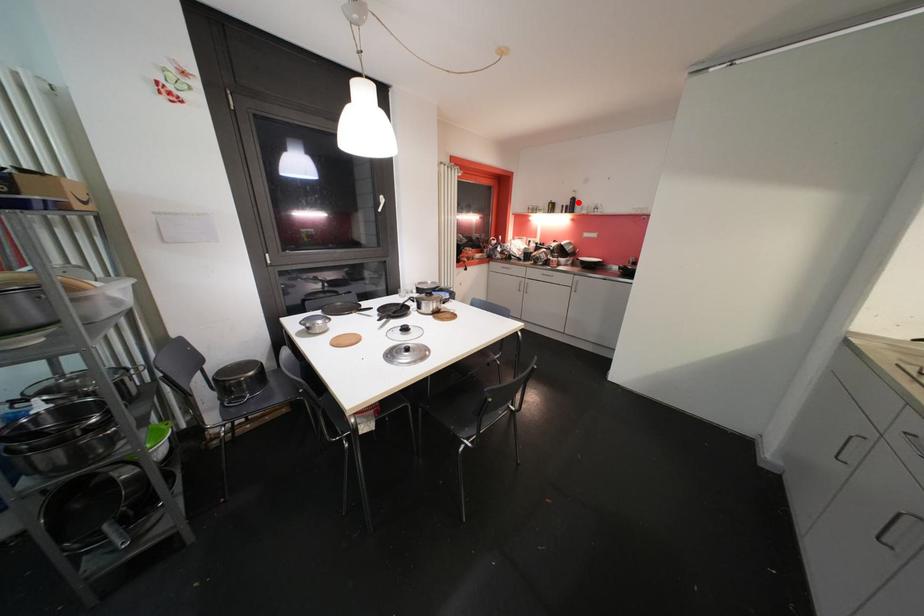
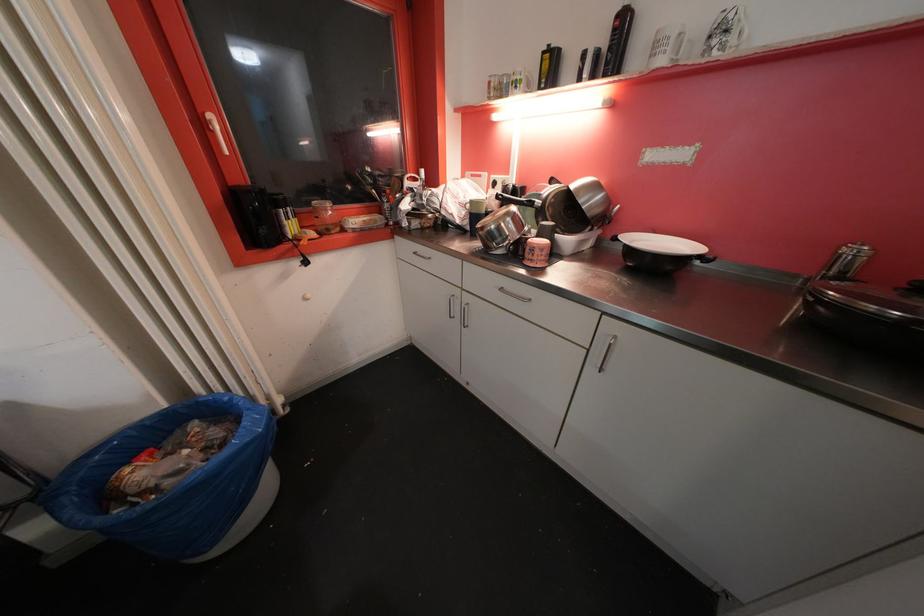
Question: A red point is marked in image1. In image2, is the corresponding 3D point closer to the camera or farther? Reply with the corresponding letter.

Choices:
 (A) The corresponding 3D point is closer.
 (B) The corresponding 3D point is farther.

Answer: (B)